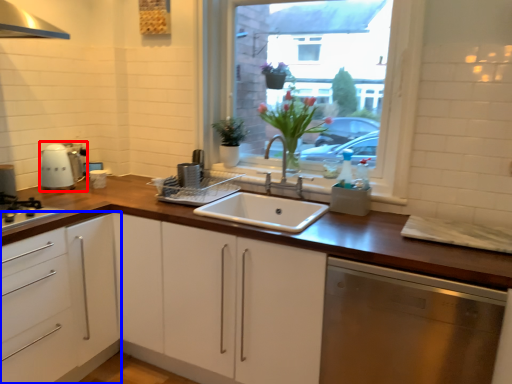
Question: Which of the following is the farthest to the observer, kitchen appliance (highlighted by a red box) or cabinetry (highlighted by a blue box)?

Choices:
 (A) kitchen appliance
 (B) cabinetry

Answer: (A)